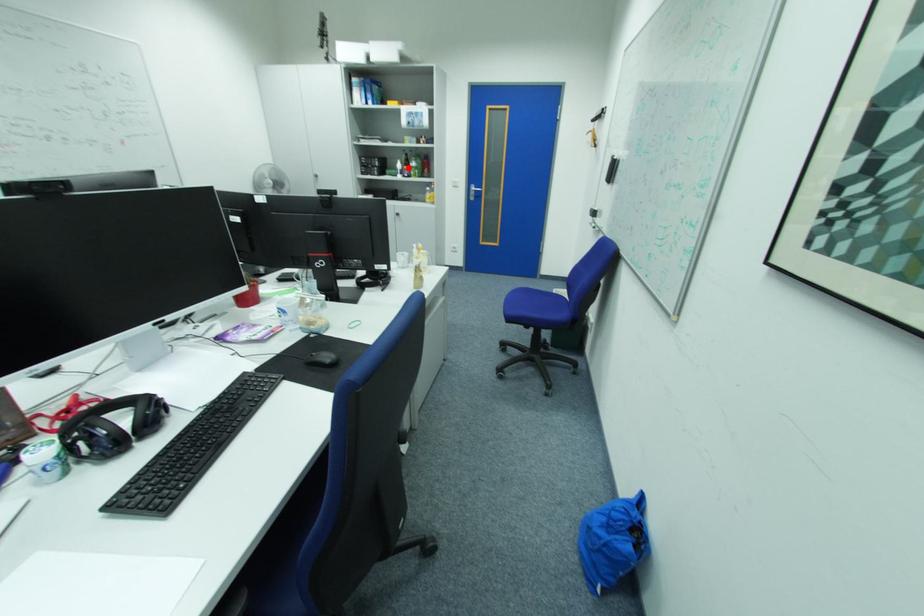
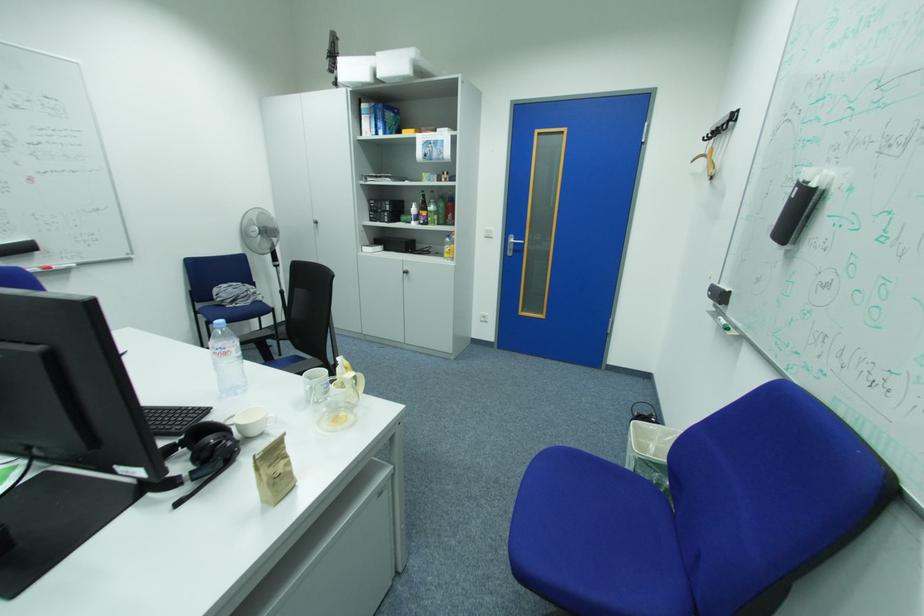
Question: I am providing you with two images of the same scene from different viewpoints. Image1 has a red point marked. In image2, the corresponding 3D location appears at what relative position? Reply with the corresponding letter.

Choices:
 (A) Closer
 (B) Farther

Answer: (B)